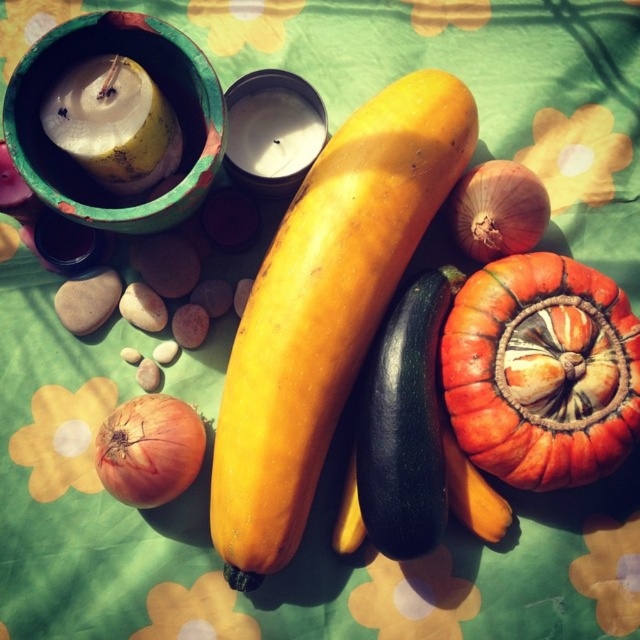
In the scene shown: Who is more forward, (269, 492) or (168, 154)?

Point (269, 492)

Measure the distance between point (260, 573) and camera.

Point (260, 573) and camera are 3.79 feet apart.

At what (x,y) coordinates should I click in order to perform the action: click on yellow matte squash at center. Please return your answer as a coordinate pair (x, y). Looking at the image, I should click on (324, 308).

Can you confirm if yellow matte squash at center is smaller than matte orange onion at lower left?

Incorrect, yellow matte squash at center is not smaller in size than matte orange onion at lower left.

Which is in front, point (234, 563) or point (140, 464)?

Point (140, 464) is in front.

Measure the distance between yellow matte squash at center and camera.

yellow matte squash at center is 1.13 meters away from camera.

Where is `yellow matte squash at center`? Image resolution: width=640 pixels, height=640 pixels. yellow matte squash at center is located at coordinates (324, 308).

Which is behind, point (116, 113) or point (525, 172)?

Point (525, 172)

Between yellow wax candle at upper left and smooth brown onion at center right, which one is positioned higher?

yellow wax candle at upper left

Which is behind, point (88, 120) or point (528, 202)?

The point (528, 202) is behind.

Find the location of a particular element. This screenshot has height=640, width=640. yellow wax candle at upper left is located at coordinates (113, 124).